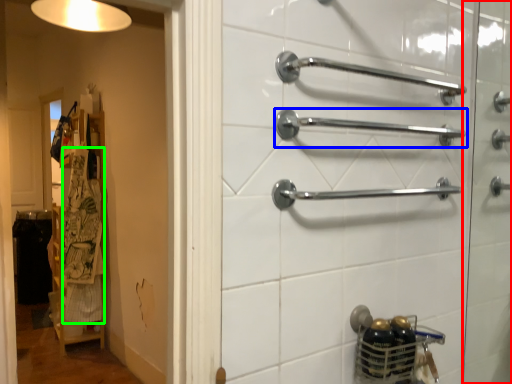
Question: Estimate the real-world distances between objects in this image. Which object is closer to screen door (highlighted by a red box), towel rack (highlighted by a blue box) or laundry (highlighted by a green box)?

Choices:
 (A) towel rack
 (B) laundry

Answer: (A)